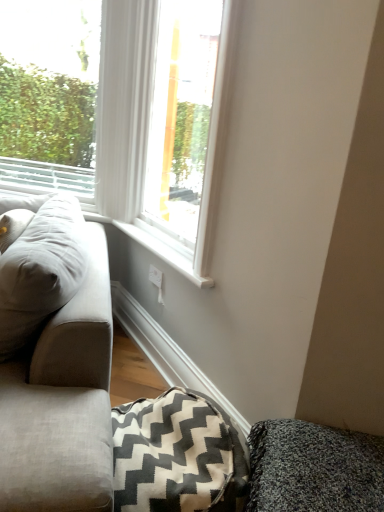
Question: Would you consider white glossy window at center, the second window when ordered from left to right, to be distant from textured gray cushion at lower right?

Choices:
 (A) no
 (B) yes

Answer: (B)

Question: From the image's perspective, is white glossy window at center, which is the first window from right to left, over textured gray cushion at lower right?

Choices:
 (A) yes
 (B) no

Answer: (A)

Question: Is white glossy window at center, which is the first window from right to left, smaller than textured gray cushion at lower right?

Choices:
 (A) yes
 (B) no

Answer: (B)

Question: Is textured gray cushion at lower right completely or partially inside white glossy window at center, the second window when ordered from left to right?

Choices:
 (A) yes
 (B) no

Answer: (B)

Question: Considering the relative sizes of white glossy window at center, the second window when ordered from left to right, and textured gray cushion at lower right in the image provided, is white glossy window at center, the second window when ordered from left to right, bigger than textured gray cushion at lower right?

Choices:
 (A) no
 (B) yes

Answer: (B)

Question: From the image's perspective, is textured gray cushion at lower right positioned above or below white painted wood at lower center?

Choices:
 (A) above
 (B) below

Answer: (B)

Question: Is textured gray cushion at lower right to the left or to the right of white painted wood at lower center in the image?

Choices:
 (A) right
 (B) left

Answer: (A)

Question: Looking at the image, does textured gray cushion at lower right seem bigger or smaller compared to white painted wood at lower center?

Choices:
 (A) small
 (B) big

Answer: (B)

Question: Considering their positions, is textured gray cushion at lower right located in front of or behind white painted wood at lower center?

Choices:
 (A) behind
 (B) front

Answer: (B)

Question: Would you say white painted wood at lower center is inside or outside textured gray cushion at lower right?

Choices:
 (A) outside
 (B) inside

Answer: (A)

Question: Relative to textured gray cushion at lower right, is white painted wood at lower center in front or behind?

Choices:
 (A) behind
 (B) front

Answer: (A)

Question: From the image's perspective, is white painted wood at lower center located above or below textured gray cushion at lower right?

Choices:
 (A) below
 (B) above

Answer: (B)

Question: Looking at their shapes, would you say white painted wood at lower center is wider or thinner than textured gray cushion at lower right?

Choices:
 (A) wide
 (B) thin

Answer: (B)

Question: Considering the positions of light gray fabric couch at left and white painted wood at lower center in the image, is light gray fabric couch at left wider or thinner than white painted wood at lower center?

Choices:
 (A) thin
 (B) wide

Answer: (B)

Question: In the image, is light gray fabric couch at left on the left side or the right side of white painted wood at lower center?

Choices:
 (A) left
 (B) right

Answer: (A)